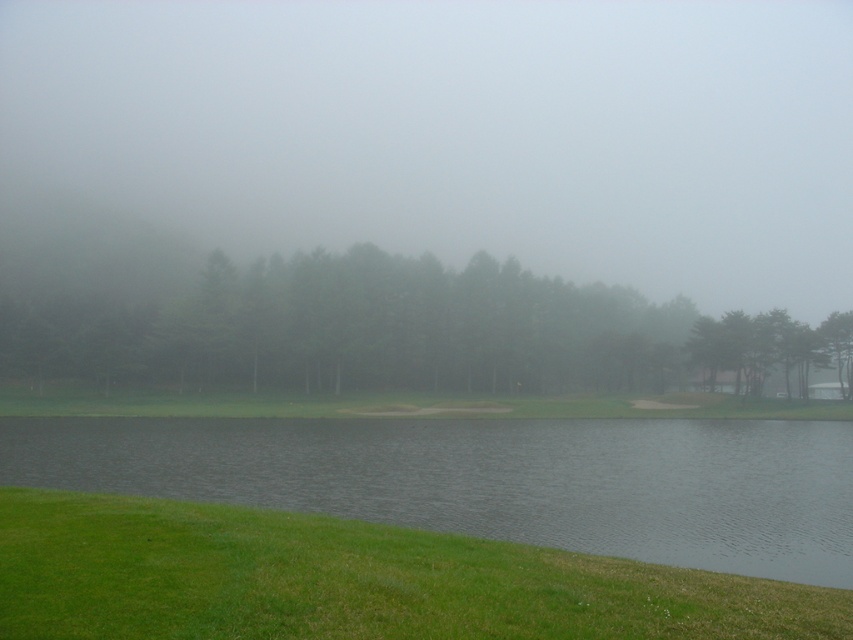
Question: Does gray water at lower center have a smaller size compared to green grass at lower left?

Choices:
 (A) no
 (B) yes

Answer: (A)

Question: Which is nearer to the green matte trees at center?

Choices:
 (A) green grass at lower left
 (B) green matte tree at upper right
 (C) gray water at lower center

Answer: (B)

Question: Which point is farther from the camera taking this photo?

Choices:
 (A) coord(323,273)
 (B) coord(366,544)

Answer: (A)

Question: Estimate the real-world distances between objects in this image. Which object is closer to the gray water at lower center?

Choices:
 (A) green grass at lower left
 (B) green matte tree at upper right
 (C) green matte trees at center

Answer: (A)

Question: Does green grass at lower left appear on the right side of green matte trees at center?

Choices:
 (A) no
 (B) yes

Answer: (A)

Question: Is green matte trees at center closer to the viewer compared to green matte tree at upper right?

Choices:
 (A) yes
 (B) no

Answer: (B)